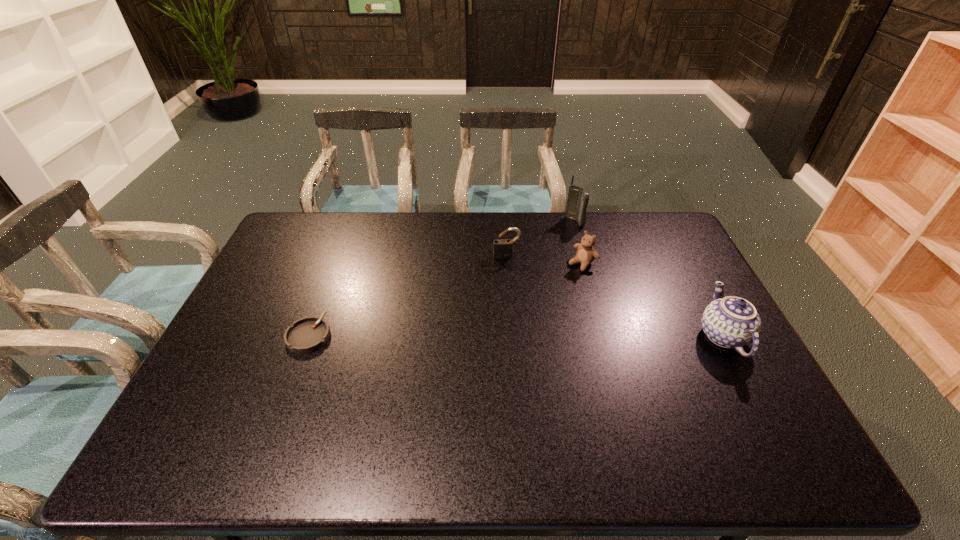
The height and width of the screenshot is (540, 960). What are the coordinates of `free location located 0.400m with the keyhole on the front of the padlock` in the screenshot? It's located at (522, 350).

What are the coordinates of `free space located with the keyhole on the front of the padlock` in the screenshot? It's located at (511, 278).

This screenshot has width=960, height=540. I want to click on vacant space positioned 0.250m on the front-facing side of the teddy bear, so click(x=528, y=309).

Identify the location of free space located on the front-facing side of the teddy bear. The image size is (960, 540). pyautogui.click(x=541, y=298).

The image size is (960, 540). What are the coordinates of `free region located 0.160m on the front-facing side of the teddy bear` in the screenshot? It's located at (545, 294).

This screenshot has height=540, width=960. I want to click on free location located on the keyboard of the tallest object, so click(542, 276).

I want to click on vacant space situated on the keyboard of the tallest object, so click(566, 237).

Locate an element on the screen. vacant space located on the keyboard of the tallest object is located at coordinates (554, 257).

This screenshot has width=960, height=540. I want to click on object situated at the far edge, so (578, 198).

Locate an element on the screen. The width and height of the screenshot is (960, 540). object at the right edge is located at coordinates (730, 322).